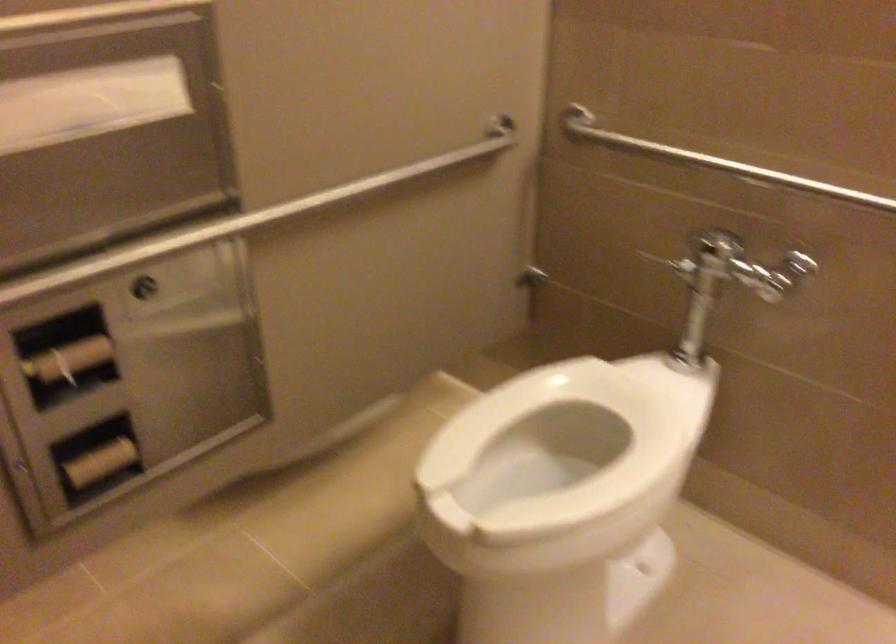
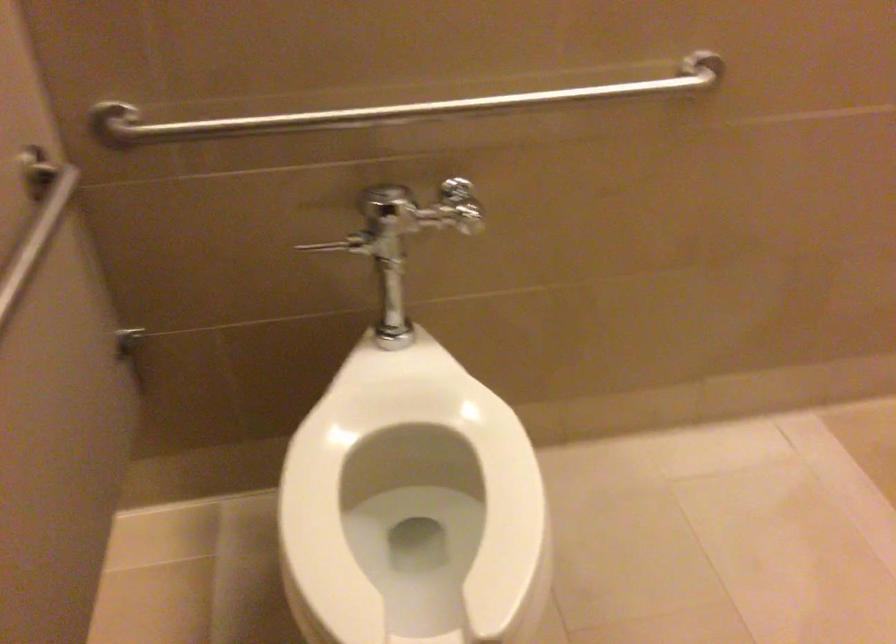
Question: How did the camera likely rotate?

Choices:
 (A) Left
 (B) Right
 (C) Up
 (D) Down

Answer: (B)